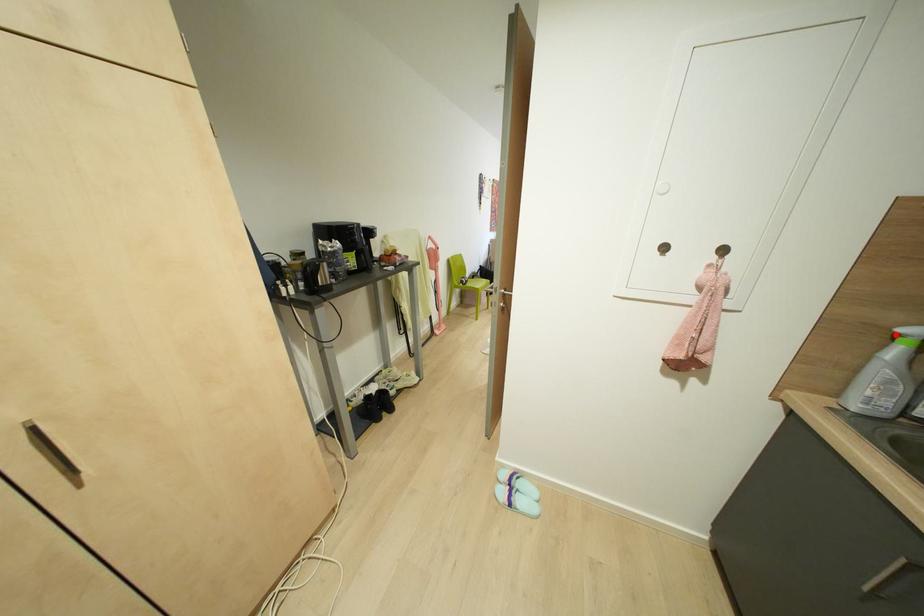
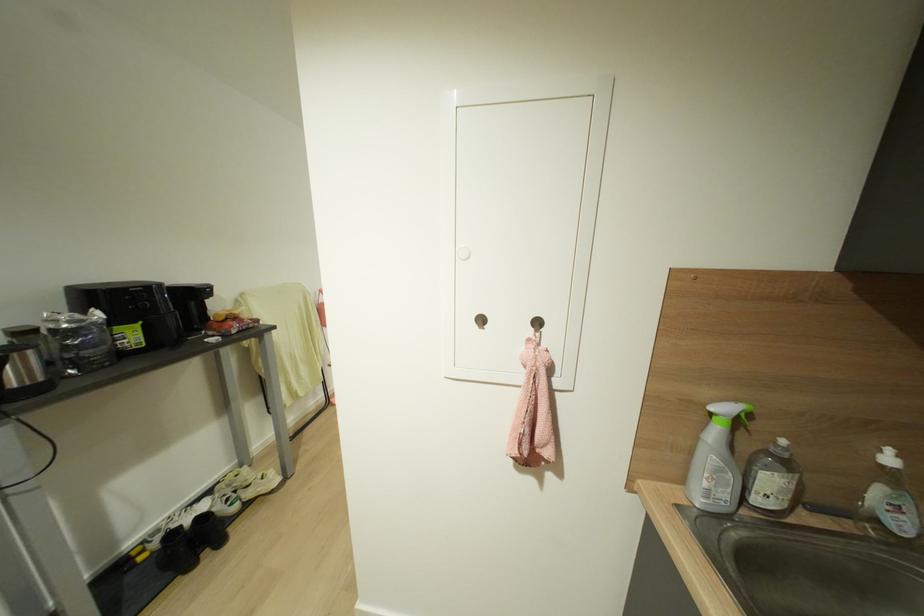
Locate, in the second image, the point that corresponds to the highlighted location in the first image.

(711, 411)